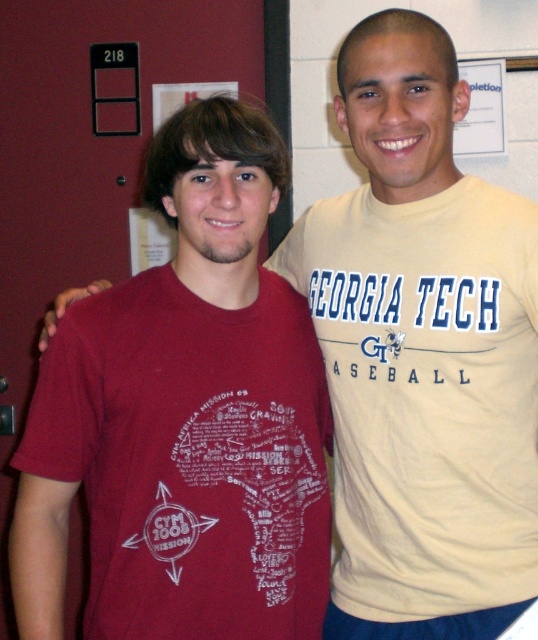
Question: Is matte red t-shirt at left positioned before light yellow cotton t-shirt at right?

Choices:
 (A) yes
 (B) no

Answer: (A)

Question: Can you confirm if matte red t-shirt at left is wider than light yellow cotton t-shirt at right?

Choices:
 (A) yes
 (B) no

Answer: (A)

Question: Among these points, which one is nearest to the camera?

Choices:
 (A) (110, 554)
 (B) (447, 563)

Answer: (A)

Question: Where is matte red t-shirt at left located in relation to light yellow cotton t-shirt at right in the image?

Choices:
 (A) right
 (B) left

Answer: (B)